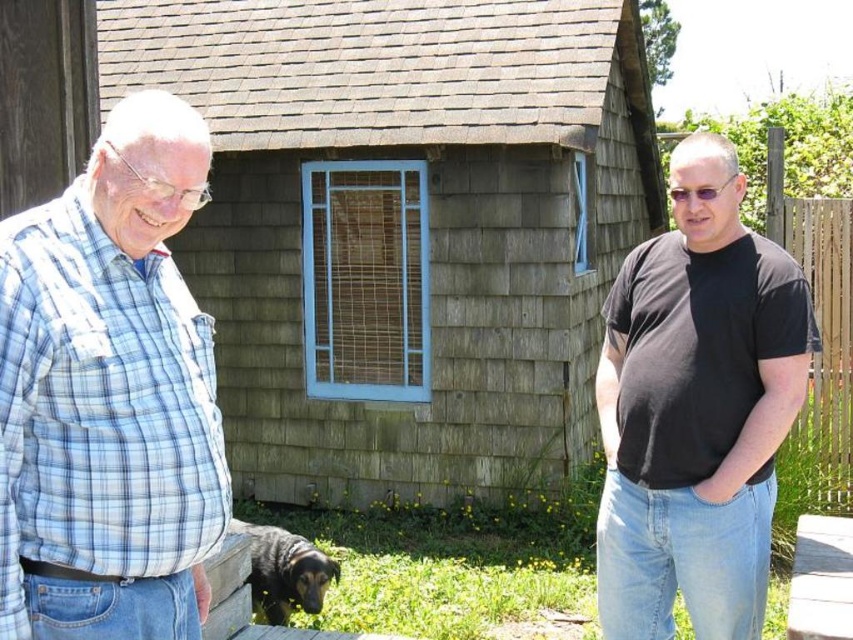
Who is taller, black matte t-shirt at right or wooden picnic table at lower right?

black matte t-shirt at right is taller.

Which is in front, point (630, 289) or point (805, 547)?

Positioned in front is point (805, 547).

Which is in front, point (680, 260) or point (807, 582)?

Point (807, 582) is more forward.

Identify the location of black matte t-shirt at right. (695, 408).

Between wooden cabin at center and blue plaid shirt at left, which one has more height?

Standing taller between the two is wooden cabin at center.

Locate an element on the screen. This screenshot has height=640, width=853. wooden cabin at center is located at coordinates (403, 227).

Find the location of a particular element. The width and height of the screenshot is (853, 640). wooden cabin at center is located at coordinates (403, 227).

Find the location of a particular element. The image size is (853, 640). wooden cabin at center is located at coordinates (403, 227).

Is wooden cabin at center wider than shiny black dog at lower left?

Correct, the width of wooden cabin at center exceeds that of shiny black dog at lower left.

Does wooden cabin at center appear on the left side of shiny black dog at lower left?

Indeed, wooden cabin at center is positioned on the left side of shiny black dog at lower left.

Is point (479, 330) less distant than point (251, 550)?

No, it is not.

You are a GUI agent. You are given a task and a screenshot of the screen. Output one action in this format:
    pyautogui.click(x=<x>, y=<y>)
    Task: Click on the wooden cabin at center
    
    Given the screenshot: What is the action you would take?
    pyautogui.click(x=403, y=227)